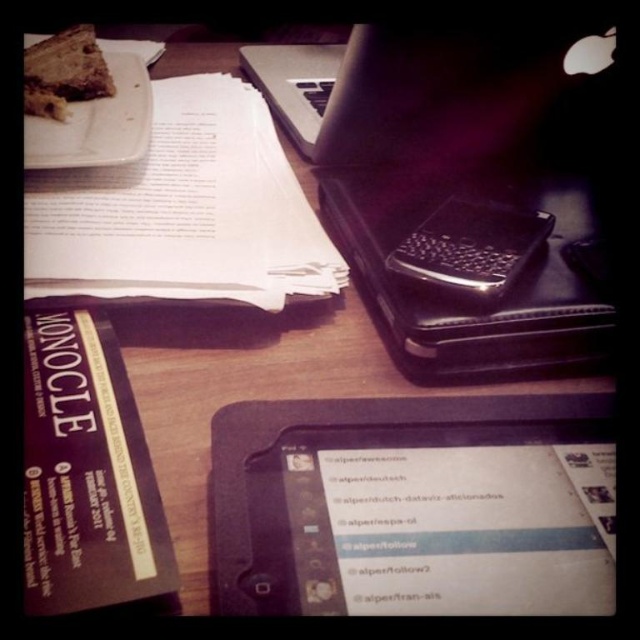
This screenshot has height=640, width=640. What do you see at coordinates (413, 506) in the screenshot?
I see `black matte tablet at center` at bounding box center [413, 506].

Can you confirm if black matte tablet at center is positioned to the left of white paper at upper left?

Incorrect, black matte tablet at center is not on the left side of white paper at upper left.

In the scene shown: Who is more distant from viewer, (474,461) or (248,276)?

Point (248,276)

Where is `black matte tablet at center`? This screenshot has height=640, width=640. black matte tablet at center is located at coordinates (413, 506).

Which is above, black matte tablet at center or white plastic plate at upper left?

Positioned higher is white plastic plate at upper left.

Which is in front, point (378, 531) or point (125, 115)?

Point (378, 531)

Describe the element at coordinates (413, 506) in the screenshot. I see `black matte tablet at center` at that location.

At what (x,y) coordinates should I click in order to perform the action: click on black matte tablet at center. Please return your answer as a coordinate pair (x, y). Image resolution: width=640 pixels, height=640 pixels. Looking at the image, I should click on (413, 506).

Which is below, matte black book at lower left or chocolate cake at upper left?

matte black book at lower left is below.

Is point (108, 525) in front of point (83, 96)?

Yes.

Who is more distant from viewer, (42, 321) or (109, 81)?

Positioned behind is point (109, 81).

Find the location of a particular element. matte black book at lower left is located at coordinates (86, 474).